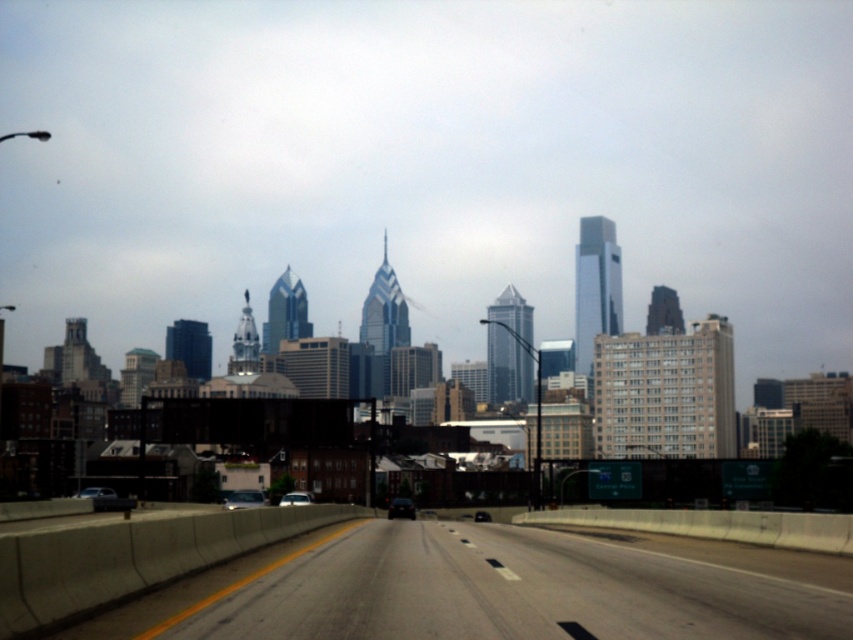
Question: Among these objects, which one is nearest to the camera?

Choices:
 (A) black glossy car at center
 (B) matte silver sedan at center

Answer: (B)

Question: Is matte silver sedan at center wider than black glossy car at center?

Choices:
 (A) yes
 (B) no

Answer: (A)

Question: Which of the following is the closest to the observer?

Choices:
 (A) black glossy car at center
 (B) shiny black sedan at center
 (C) matte black sedan at center
 (D) metallic silver sedan at center

Answer: (D)

Question: Can you confirm if matte black sedan at center is bigger than black glossy car at center?

Choices:
 (A) yes
 (B) no

Answer: (A)

Question: Can you confirm if metallic silver sedan at center is positioned above matte black sedan at center?

Choices:
 (A) yes
 (B) no

Answer: (A)

Question: Among these points, which one is nearest to the camera?

Choices:
 (A) (480, 522)
 (B) (305, 502)
 (C) (96, 497)

Answer: (B)